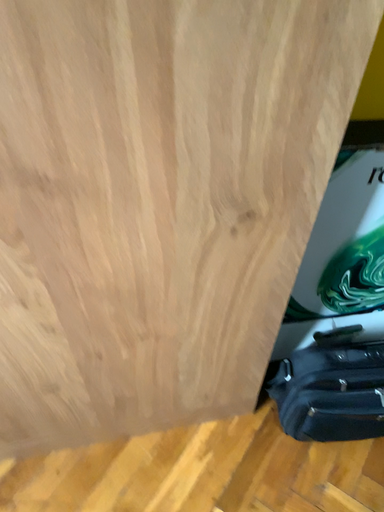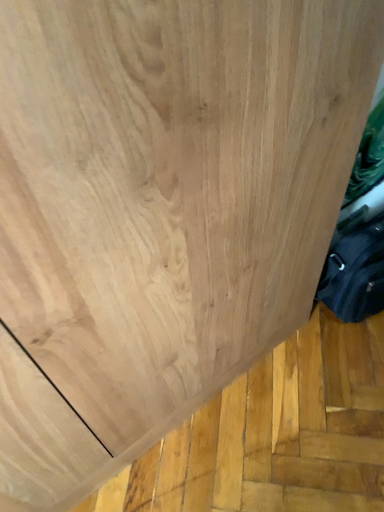
Question: Which way did the camera rotate in the video?

Choices:
 (A) rotated left
 (B) rotated right

Answer: (B)